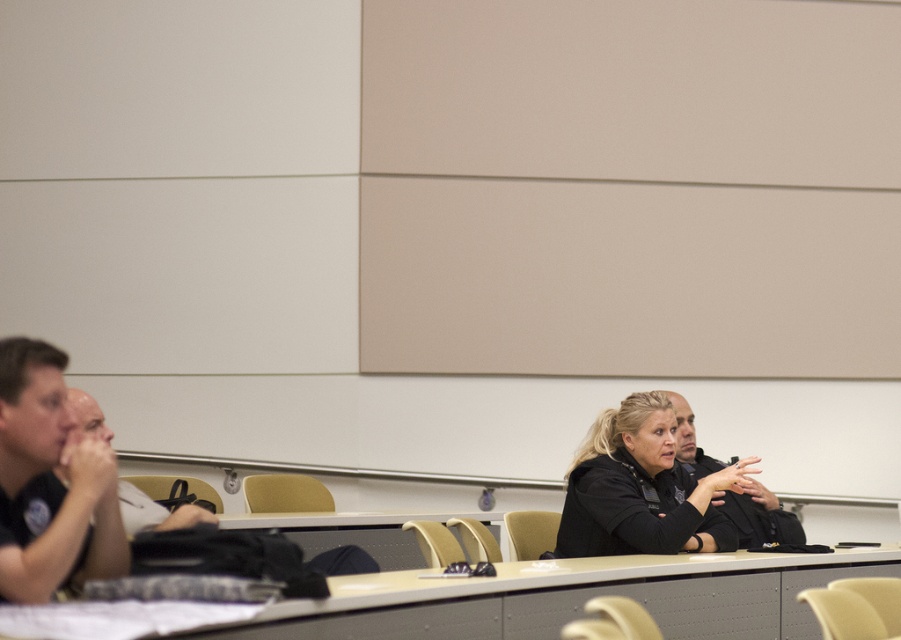
You are organizing a small event and need to seat two guests. You have a table that can only accommodate one person comfortably. Based on the image, which guest between the black matte shirt at left and the black uniform at center would you choose to seat at the table to ensure they have enough space?

The black matte shirt at left has a smaller width than the black uniform at center, so seating the black matte shirt at left would provide enough space at the table.

You are organizing a small meeting in the lecture hall and need to place a 1.2 meter wide laptop cart between the smooth beige table at lower center and the black matte shirt at left. Can the laptop cart fit between them based on their widths?

The smooth beige table at lower center is wider than the black matte shirt at left. However, the exact width difference isn not specified, so it is uncertain if the 1.2 meter wide laptop cart can fit between them without more precise measurements.

You are attending a meeting in the lecture hall and notice two people sitting at the front table. One is wearing a black matte shirt at left, and the other is in a black uniform at center. From your perspective, which person is sitting to the left of the other?

The black matte shirt at left is positioned on the left side of the black uniform at center, so the person in the black matte shirt at left is sitting to the left of the person in the black uniform at center.